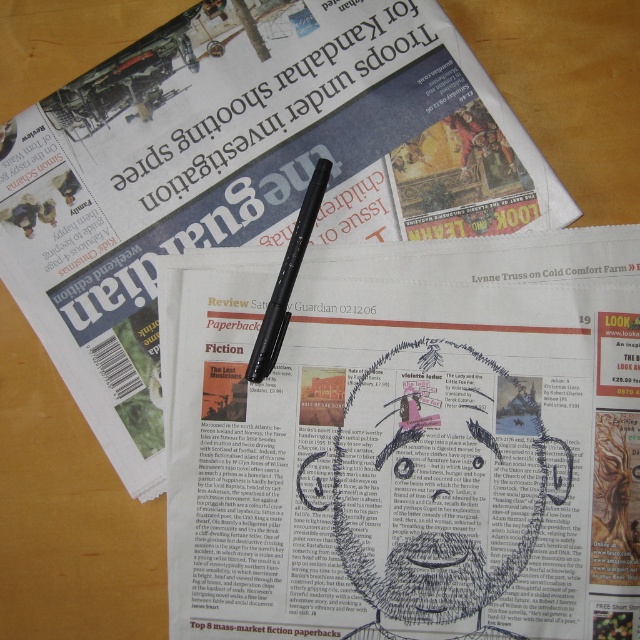
Which is more to the right, white paper at center or black plastic pen at center?

white paper at center

Is point (355, 452) less distant than point (273, 308)?

Yes.

Identify the location of white paper at center. This screenshot has height=640, width=640. (406, 442).

Locate an element on the screen. white paper at center is located at coordinates (406, 442).